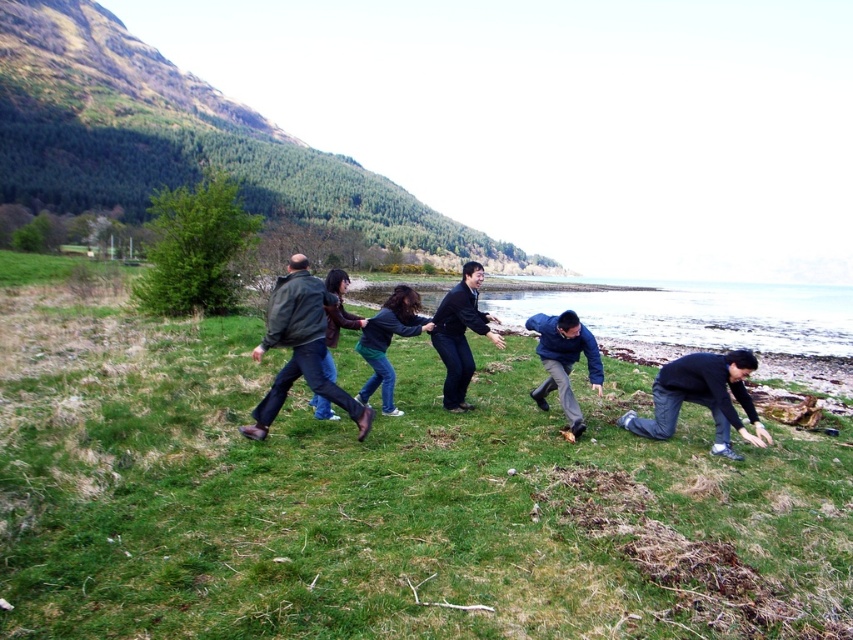
You are standing at the origin point in the image. Which of the two points, point (457,627) or point (601,381), is closer to you?

Point (457,627) is in front of point (601,381), so it is closer to you.

You are an observer standing in the middle of the scene. You want to look at the brown leather jacket at center without moving your head. Do you need to move your gaze past the green grassy hillside at upper left?

The brown leather jacket at center is behind the green grassy hillside at upper left, so yes, you need to move your gaze past the green grassy hillside at upper left to see the brown leather jacket at center.

You are a photographer trying to capture a candid shot of the two people wearing the dark blue jeans at center and brown leather jacket at center. You have a camera with a 50mm lens that has a maximum aperture of f1.8. To ensure both subjects are in focus, what should you do?

Since the dark blue jeans at center and brown leather jacket at center are 25.80 inches apart, you should use a smaller aperture setting like f8 or higher to increase the depth of field, ensuring both subjects are in focus.